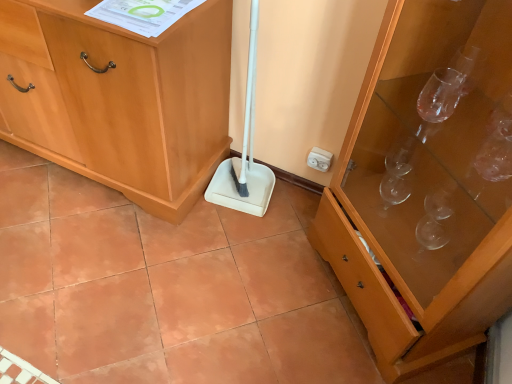
Question: Choose the correct answer: Is white plastic electric outlet at upper right inside white plastic shovel at center or outside it?

Choices:
 (A) outside
 (B) inside

Answer: (A)

Question: In terms of width, does white plastic electric outlet at upper right look wider or thinner when compared to white plastic shovel at center?

Choices:
 (A) thin
 (B) wide

Answer: (A)

Question: Which of these objects is positioned farthest from the white plastic shovel at center?

Choices:
 (A) transparent glass cabinet at right, which ranks as the second cabinetry in left-to-right order
 (B) terracotta ceramic tile at center
 (C) light wood cabinet at center, placed as the first cabinetry when sorted from left to right
 (D) white plastic electric outlet at upper right

Answer: (A)

Question: Which object is positioned closest to the white plastic shovel at center?

Choices:
 (A) white plastic electric outlet at upper right
 (B) transparent glass cabinet at right, acting as the first cabinetry starting from the right
 (C) light wood cabinet at center, placed as the first cabinetry when sorted from left to right
 (D) terracotta ceramic tile at center

Answer: (A)